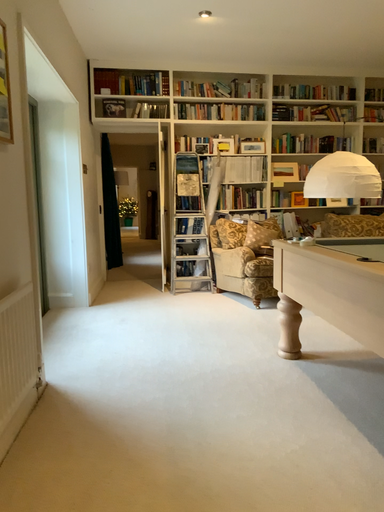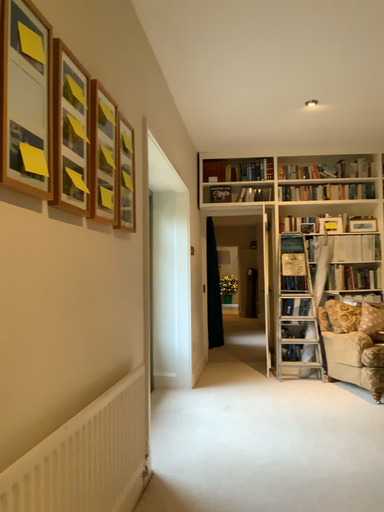
Question: How did the camera likely rotate when shooting the video?

Choices:
 (A) rotated downward
 (B) rotated upward

Answer: (B)